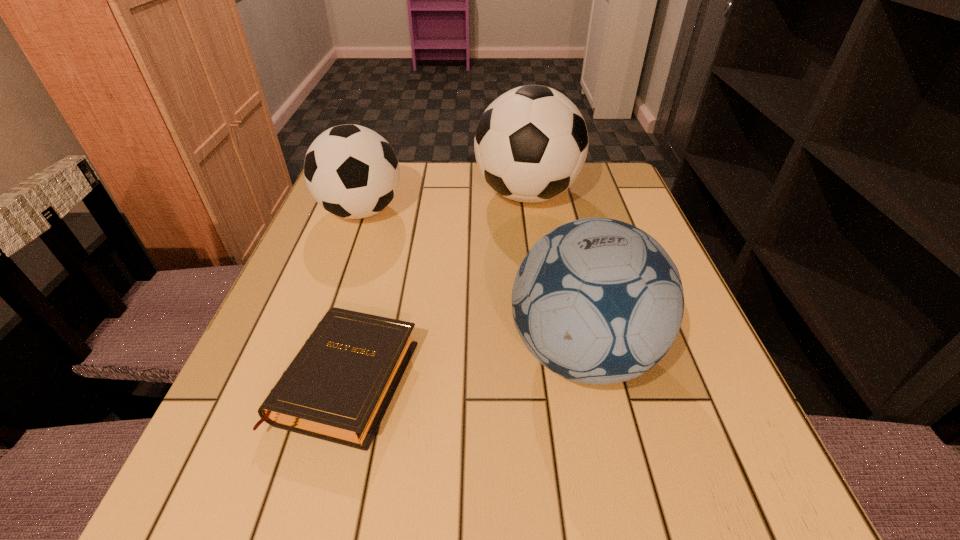
Where is `object that can be found as the third closest to the nearest soccer ball`? object that can be found as the third closest to the nearest soccer ball is located at coordinates (351, 171).

Locate which soccer ball is the second closest to the nearest soccer ball. Please provide its 2D coordinates. Your answer should be formatted as a tuple, i.e. [(x, y)], where the tuple contains the x and y coordinates of a point satisfying the conditions above.

[(351, 171)]

Identify which soccer ball is the second nearest to the Bible. Please provide its 2D coordinates. Your answer should be formatted as a tuple, i.e. [(x, y)], where the tuple contains the x and y coordinates of a point satisfying the conditions above.

[(351, 171)]

Identify the location of free location that satisfies the following two spatial constraints: 1. on the front side of the leftmost soccer ball; 2. on the right side of the shortest object. [301, 380].

The image size is (960, 540). I want to click on vacant space that satisfies the following two spatial constraints: 1. on the side with brand of the nearest soccer ball; 2. on the front side of the shortest object, so click(x=588, y=380).